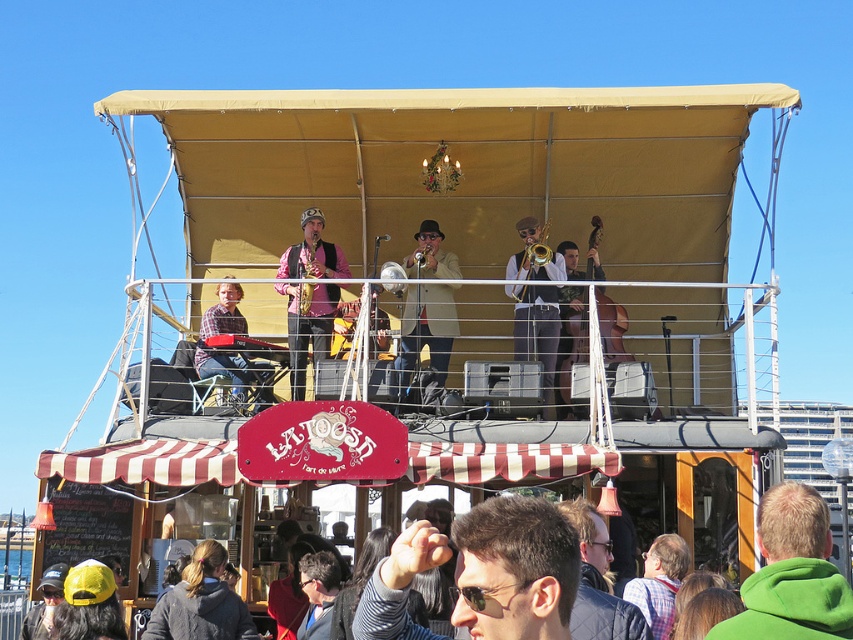
Is green fleece jacket at lower right bigger than matte gold trombone at center?

Correct, green fleece jacket at lower right is larger in size than matte gold trombone at center.

The height and width of the screenshot is (640, 853). What are the coordinates of `green fleece jacket at lower right` in the screenshot? It's located at (792, 573).

Is sunglasses at center positioned before shiny gold saxophone at center?

Yes, it is in front of shiny gold saxophone at center.

Who is positioned more to the right, sunglasses at center or shiny gold saxophone at center?

sunglasses at center

Find the location of a particular element. The width and height of the screenshot is (853, 640). sunglasses at center is located at coordinates (515, 570).

Find the location of a particular element. This screenshot has width=853, height=640. sunglasses at center is located at coordinates (515, 570).

Locate an element on the screen. sunglasses at center is located at coordinates (515, 570).

Can you confirm if sunglasses at center is bigger than gold metallic saxophone at center?

Correct, sunglasses at center is larger in size than gold metallic saxophone at center.

Locate an element on the screen. The width and height of the screenshot is (853, 640). sunglasses at center is located at coordinates (515, 570).